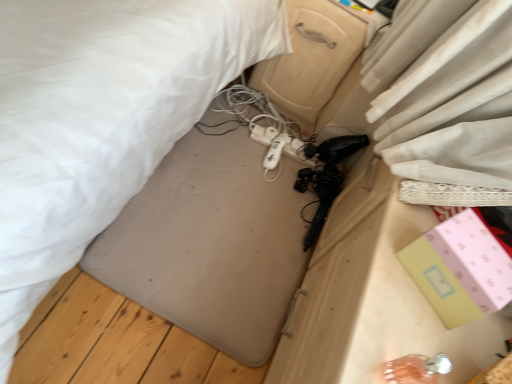
What are the coordinates of `blank space to the left of white plastic hairdryer at center` in the screenshot? It's located at (239, 131).